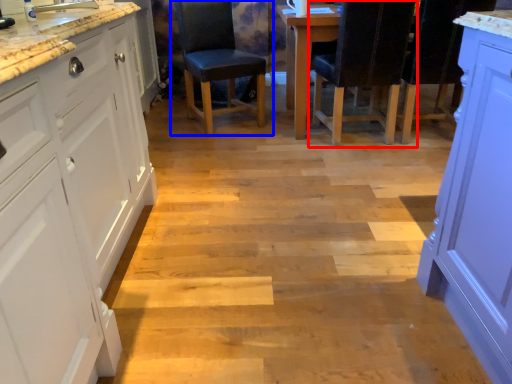
Question: Which of the following is the closest to the observer, chair (highlighted by a red box) or chair (highlighted by a blue box)?

Choices:
 (A) chair
 (B) chair

Answer: (A)